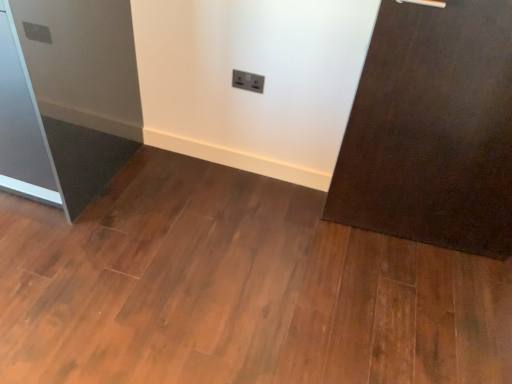
At what (x,y) coordinates should I click in order to perform the action: click on spots to the right of satin silver fridge at left. Please return your answer as a coordinate pair (x, y). The image size is (512, 384). Looking at the image, I should click on point(160,202).